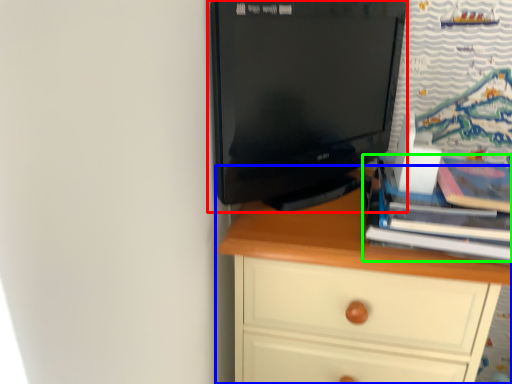
Question: Considering the real-world distances, which object is farthest from computer monitor (highlighted by a red box)? chest of drawers (highlighted by a blue box) or book (highlighted by a green box)?

Choices:
 (A) chest of drawers
 (B) book

Answer: (B)